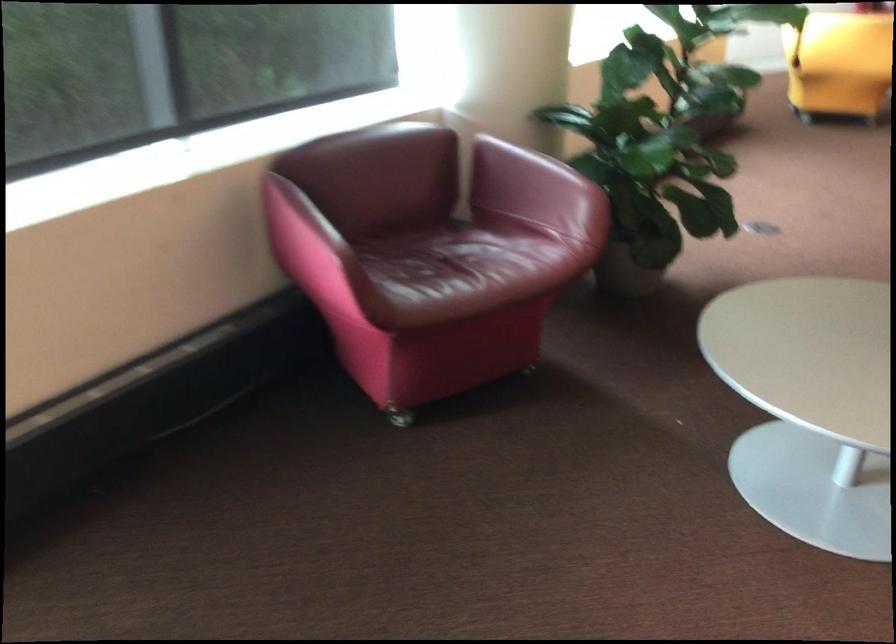
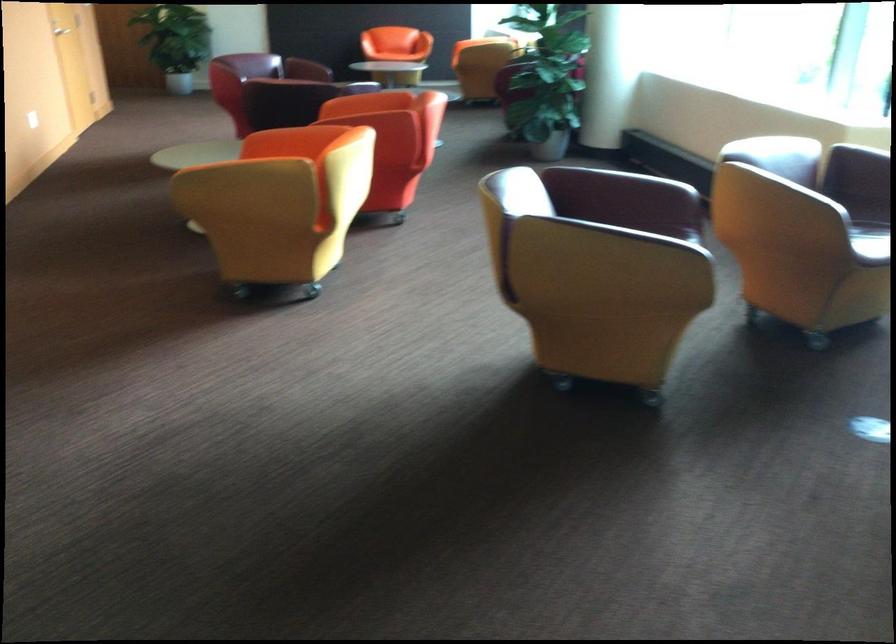
Question: I am providing you with two images of the same scene from different viewpoints. Please identify which objects are invisible in image2.

Choices:
 (A) orange chair sitting surface
 (B) chair caster wheel
 (C) lanyard collection
 (D) red chair armrest

Answer: (B)